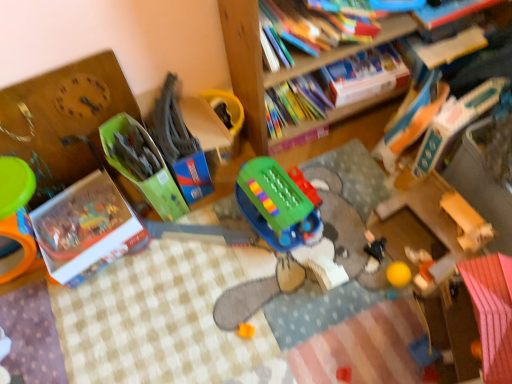
This screenshot has width=512, height=384. I want to click on free space that is to the left of orange matte cube at center, the 4th toy viewed from the right, so click(x=194, y=333).